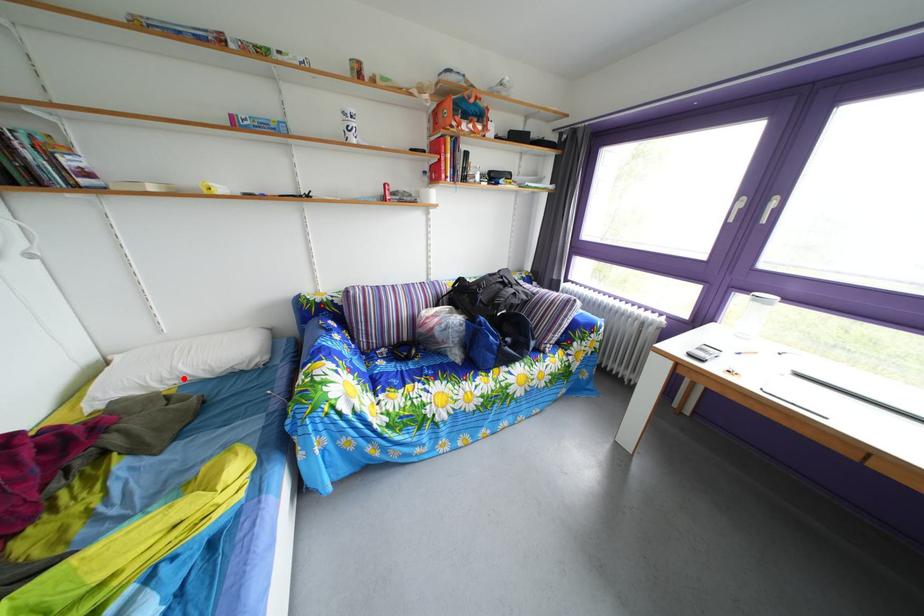
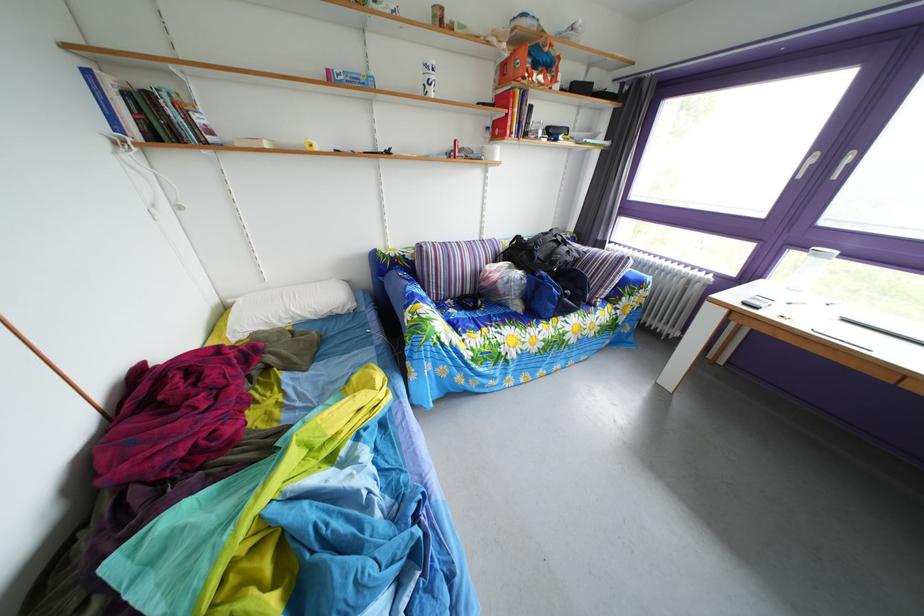
Locate, in the second image, the point that corresponds to the highlighted location in the first image.

(298, 320)